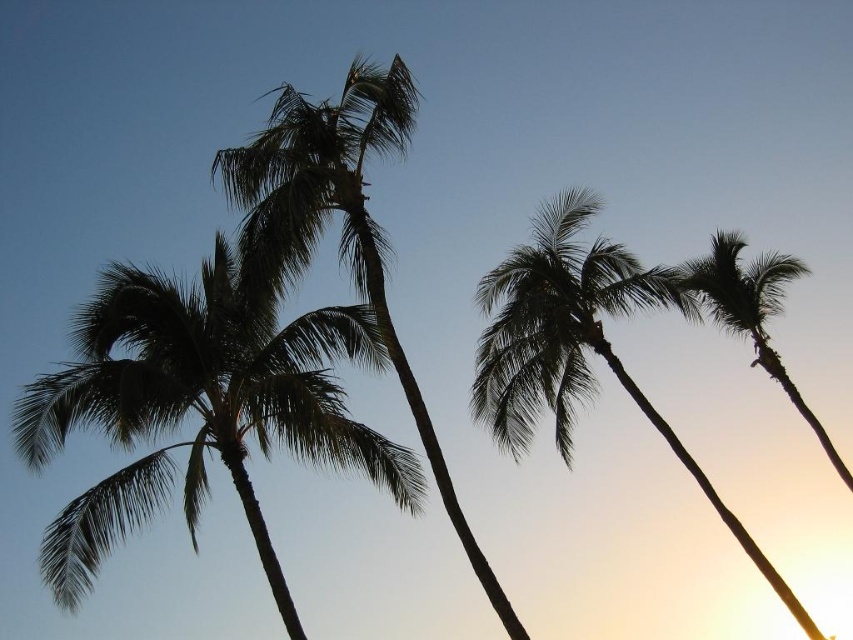
Is silhouette leafy palm at left thinner than silhouette leafy palm at right?

Yes.

I want to click on silhouette leafy palm at left, so click(196, 410).

Who is higher up, silhouette leafy palm at center or silhouette leafy palm at right?

silhouette leafy palm at right

Who is more forward, (485,560) or (798,275)?

Point (485,560)

This screenshot has width=853, height=640. What are the coordinates of `silhouette leafy palm at center` in the screenshot? It's located at (341, 227).

Is point (264, 317) closer to camera compared to point (384, 138)?

Yes.

Based on the photo, is silhouette leafy palm at left to the left of silhouette leafy palm at center from the viewer's perspective?

Indeed, silhouette leafy palm at left is positioned on the left side of silhouette leafy palm at center.

Find the location of `silhouette leafy palm at left`. silhouette leafy palm at left is located at coordinates (196, 410).